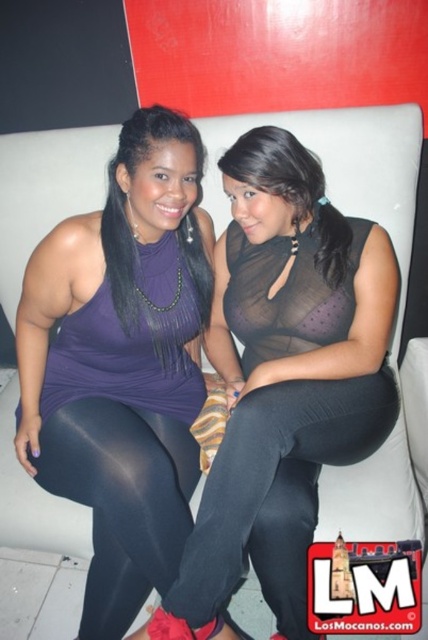
Does purple matte tank top at center appear on the left side of black spandex leggings at center?

Correct, you'll find purple matte tank top at center to the left of black spandex leggings at center.

Who is more forward, (265,145) or (264,540)?

Point (264,540)

Between point (261, 388) and point (273, 570), which one is positioned in front?

Point (273, 570) is more forward.

Identify the location of purple matte tank top at center. The height and width of the screenshot is (640, 428). pyautogui.click(x=285, y=372).

Who is higher up, matte black leggings at lower left or matte purple top at center?

Positioned higher is matte purple top at center.

Between point (77, 413) and point (127, 122), which one is positioned in front?

Point (127, 122)

This screenshot has height=640, width=428. In order to click on matte black leggings at lower left in this screenshot , I will do pos(121,500).

Is matte purple tank top at center positioned at the back of matte purple top at center?

No.

Is matte purple tank top at center below matte purple top at center?

Yes.

You are a GUI agent. You are given a task and a screenshot of the screen. Output one action in this format:
    pyautogui.click(x=<x>, y=<y>)
    Task: Click on the matte purple tank top at center
    
    Given the screenshot: What is the action you would take?
    pyautogui.click(x=122, y=358)